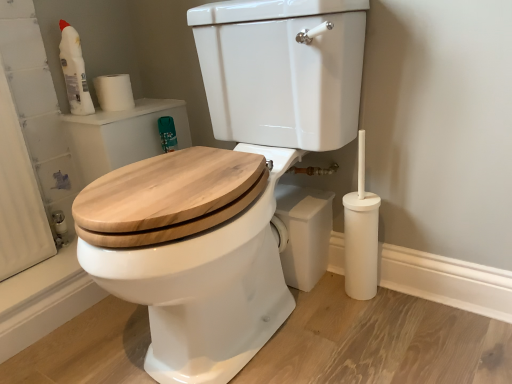
Question: From the image's perspective, is white plastic bottle at upper left below white plastic toilet brush at lower right?

Choices:
 (A) yes
 (B) no

Answer: (B)

Question: Can you confirm if white plastic bottle at upper left is thinner than white plastic toilet brush at lower right?

Choices:
 (A) no
 (B) yes

Answer: (B)

Question: Is white plastic bottle at upper left closer to the viewer compared to white plastic toilet brush at lower right?

Choices:
 (A) no
 (B) yes

Answer: (A)

Question: From a real-world perspective, is white plastic bottle at upper left physically below white plastic toilet brush at lower right?

Choices:
 (A) no
 (B) yes

Answer: (A)

Question: From the image's perspective, is white plastic bottle at upper left above white plastic toilet brush at lower right?

Choices:
 (A) yes
 (B) no

Answer: (A)

Question: Is white plastic bottle at upper left completely or partially outside of white plastic toilet brush at lower right?

Choices:
 (A) no
 (B) yes

Answer: (B)

Question: Considering the relative positions of white matte toilet paper at upper left and natural wood toilet seat at center in the image provided, is white matte toilet paper at upper left behind natural wood toilet seat at center?

Choices:
 (A) no
 (B) yes

Answer: (B)

Question: Is white matte toilet paper at upper left in contact with natural wood toilet seat at center?

Choices:
 (A) yes
 (B) no

Answer: (B)

Question: From a real-world perspective, is white matte toilet paper at upper left beneath natural wood toilet seat at center?

Choices:
 (A) yes
 (B) no

Answer: (B)

Question: Does white matte toilet paper at upper left have a larger size compared to natural wood toilet seat at center?

Choices:
 (A) no
 (B) yes

Answer: (A)

Question: From a real-world perspective, is white matte toilet paper at upper left on top of natural wood toilet seat at center?

Choices:
 (A) no
 (B) yes

Answer: (B)

Question: Is the position of white matte toilet paper at upper left less distant than that of natural wood toilet seat at center?

Choices:
 (A) yes
 (B) no

Answer: (B)

Question: Is white plastic bottle at upper left surrounding natural wood toilet seat at center?

Choices:
 (A) yes
 (B) no

Answer: (B)